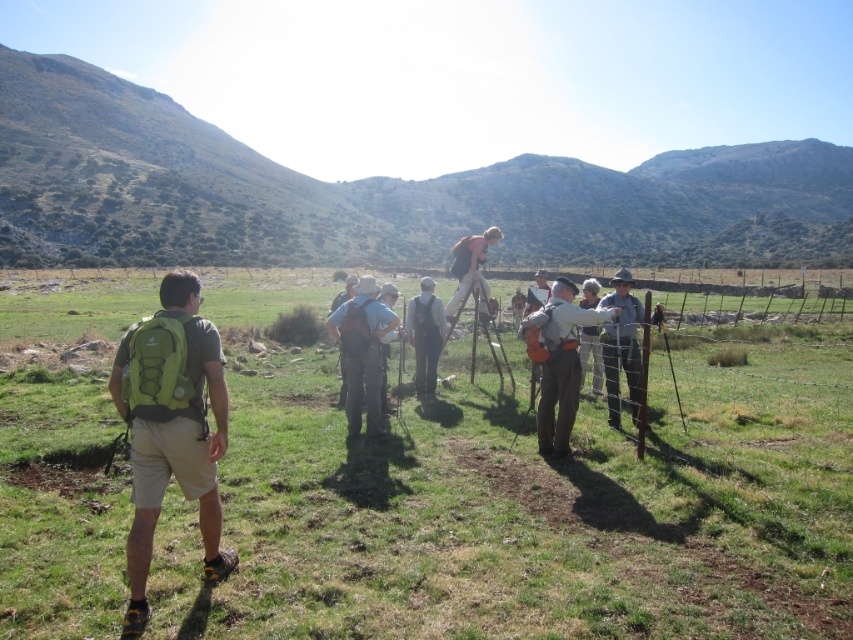
You are standing at the origin point of the image. Which direction should you move to reach the green grassy field at center?

The green grassy field at center is located at coordinates point (521, 496), so you should move towards the lower right direction from your current position at the origin point.

You are a photographer trying to capture a wide shot of the scene. The green grassy field at center and the khaki fabric shirt at right are both important elements. Which object should you prioritize framing first to ensure both are visible in the shot?

The green grassy field at center is wider than the khaki fabric shirt at right, so you should prioritize framing the green grassy field at center first to ensure both are visible in the shot.